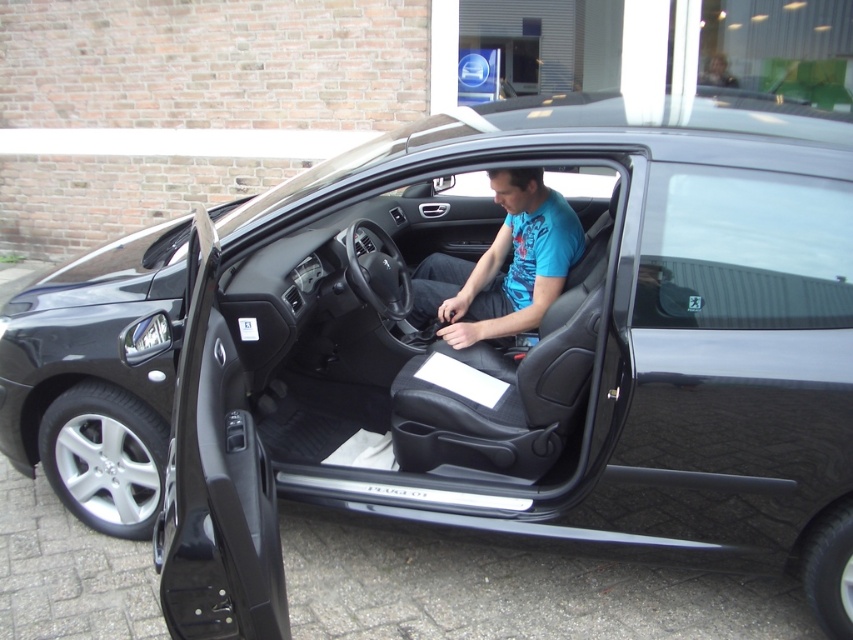
You are a delivery person trying to hand a package to the driver inside the black Peugeot car. The driver is sitting in the driver seat wearing the blue matte shirt at center. The car door, the black matte door at center, is open. Can you reach the driver to hand over the package without entering the car?

The black matte door at center is 15.51 inches away from the blue matte shirt at center. Since the distance between the open door and the driver wearing the blue matte shirt at center is only about 15.51 inches, it would be difficult to reach them comfortably without entering the car. You might need to lean in or ask them to extend their hand slightly.

You are a delivery person standing in front of the black matte door at center. You need to deliver a package that requires you to be within 6 feet of the door to scan it. Can you scan the package from your current position?

The black matte door at center is 5.92 feet from camera, so yes, you can scan the package from your current position since you are within the 6 feet requirement.

You are a delivery person trying to hand a package to the driver inside the car. The driver is sitting in the driver seat with the door open. Can you reach the blue matte shirt at center through the open black matte door at center?

The black matte door at center is in front of the blue matte shirt at center, so you cannot reach the blue matte shirt at center through the open black matte shirt at center because the door is blocking the access.